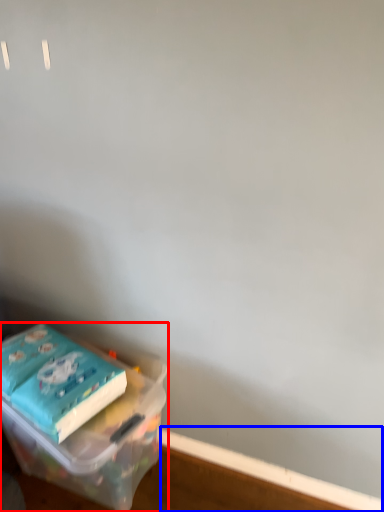
Question: Which of the following is the farthest to the observer, box (highlighted by a red box) or window sill (highlighted by a blue box)?

Choices:
 (A) box
 (B) window sill

Answer: (B)